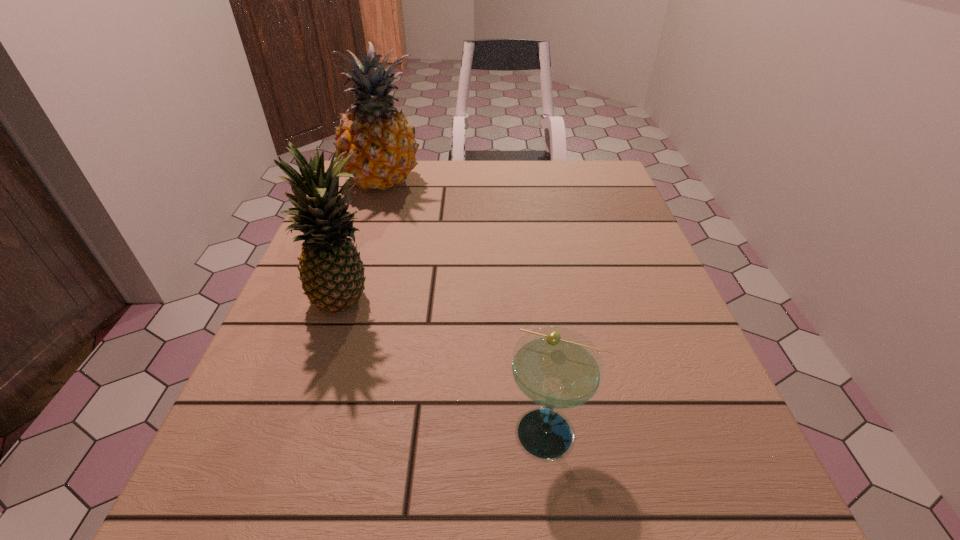
Image resolution: width=960 pixels, height=540 pixels. What are the coordinates of `the farther pineapple` in the screenshot? It's located at (386, 147).

The height and width of the screenshot is (540, 960). Identify the location of the nearer pineapple. (x=332, y=274).

Where is `martini`? martini is located at coordinates (556, 368).

Locate an element on the screen. the shortest object is located at coordinates (556, 368).

This screenshot has width=960, height=540. I want to click on free spot located on the front of the farther pineapple, so click(x=354, y=276).

Image resolution: width=960 pixels, height=540 pixels. I want to click on blank space located on the right of the nearer pineapple, so click(537, 302).

Locate an element on the screen. The image size is (960, 540). free region located 0.350m on the back of the shortest object is located at coordinates (528, 257).

The height and width of the screenshot is (540, 960). Find the location of `object that is positioned at the far edge`. object that is positioned at the far edge is located at coordinates (386, 147).

At what (x,y) coordinates should I click in order to perform the action: click on object at the far left corner. Please return your answer as a coordinate pair (x, y). This screenshot has width=960, height=540. Looking at the image, I should click on (386, 147).

In the image, there is a desktop. Identify the location of vacant space at the far edge. click(x=462, y=164).